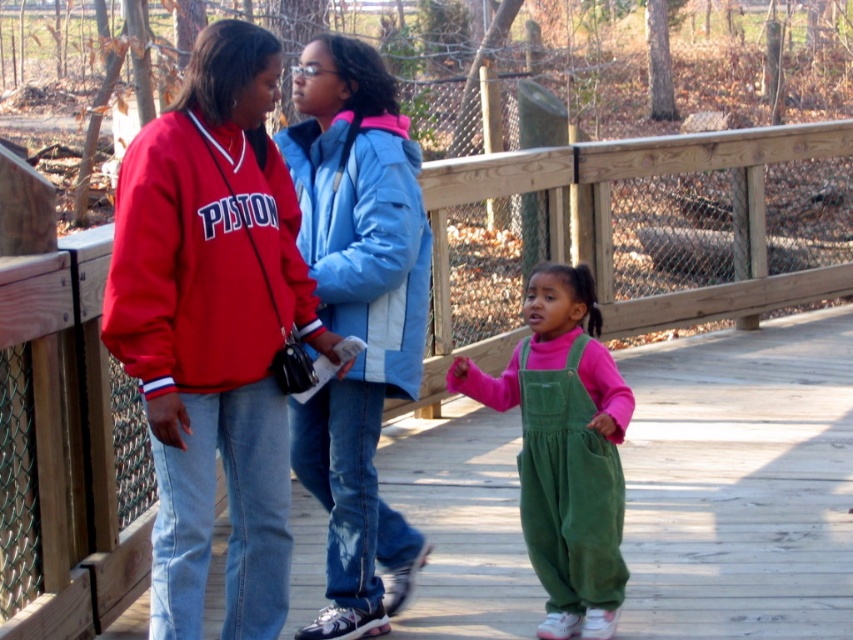
Question: Is light blue jacket at center wider than blue fleece sweatshirt at center?

Choices:
 (A) yes
 (B) no

Answer: (B)

Question: Does matte red jacket at center appear over blue fleece sweatshirt at center?

Choices:
 (A) yes
 (B) no

Answer: (B)

Question: Which of the following is the closest to the observer?

Choices:
 (A) (534, 392)
 (B) (340, 264)

Answer: (B)

Question: Which point appears closest to the camera in this image?

Choices:
 (A) (538, 524)
 (B) (233, 381)
 (C) (132, 364)

Answer: (C)

Question: Which point is closer to the camera taking this photo?

Choices:
 (A) (294, 637)
 (B) (399, 212)
 (C) (254, 164)
 (D) (312, 305)

Answer: (C)

Question: Can you confirm if light blue jacket at center is thinner than green corduroy overalls at center?

Choices:
 (A) yes
 (B) no

Answer: (A)